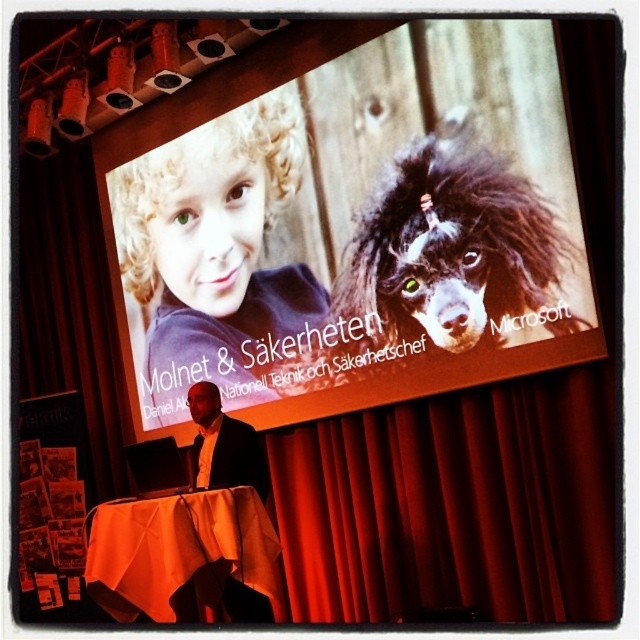
Does orange fabric table at lower left have a smaller size compared to dark suit at center?

No, orange fabric table at lower left is not smaller than dark suit at center.

Is point (196, 506) farther from camera compared to point (237, 442)?

That is False.

Is point (129, 576) less distant than point (195, 388)?

Yes.

Where is `orange fabric table at lower left`? orange fabric table at lower left is located at coordinates (180, 554).

Is curly blonde hair at upper left in front of dark suit at center?

That is False.

Looking at this image, does curly blonde hair at upper left appear on the left side of dark suit at center?

Correct, you'll find curly blonde hair at upper left to the left of dark suit at center.

Which is behind, point (220, 326) or point (260, 449)?

Positioned behind is point (220, 326).

Identify the location of curly blonde hair at upper left. The height and width of the screenshot is (640, 640). (216, 260).

How far apart are curly blonde hair at upper left and orange fabric table at lower left?

curly blonde hair at upper left is 5.91 feet from orange fabric table at lower left.

Which of these two, curly blonde hair at upper left or orange fabric table at lower left, stands taller?

curly blonde hair at upper left is taller.

Who is more distant from viewer, (204, 177) or (100, 564)?

Point (204, 177)

Where is `curly blonde hair at upper left`? curly blonde hair at upper left is located at coordinates (216, 260).